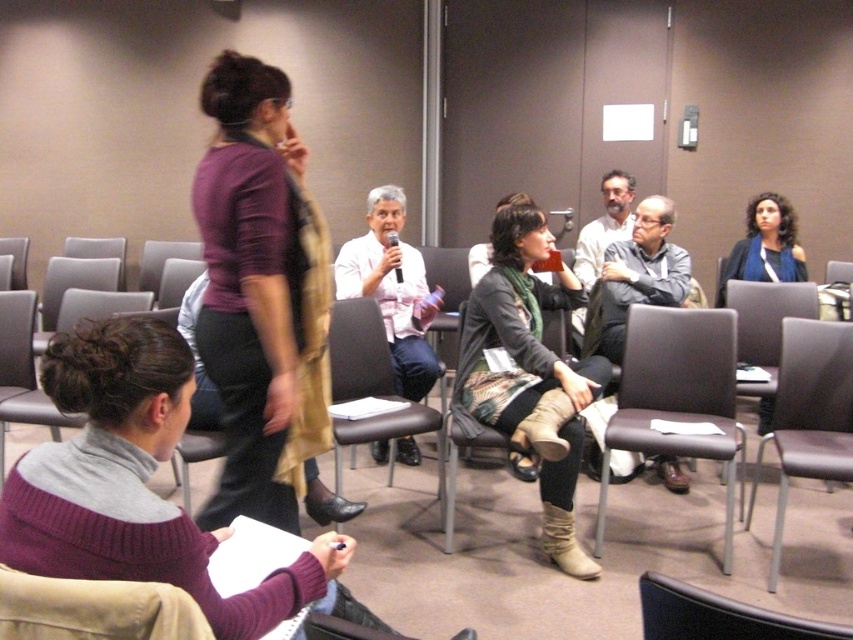
You are a photographer standing at the back of the conference room. You want to take a photo of the green scarf at center and the dark gray fabric chair at lower right. Which object will appear larger in the photo?

The green scarf at center will appear larger in the photo because it is taller than the dark gray fabric chair at lower right.

You are a photographer setting up for a group photo in the conference room. You need to ensure that the pink fabric shirt at center and the beige fabric chair at lower left are both visible in the shot. Given their height difference, which object might block the view of the other if positioned directly in front?

The pink fabric shirt at center is taller than the beige fabric chair at lower left. Therefore, if the pink fabric shirt at center is placed in front, it could block the view of the beige fabric chair at lower left. Conversely, if the beige fabric chair at lower left is in front, it would not obstruct the pink fabric shirt at center due to its shorter height.